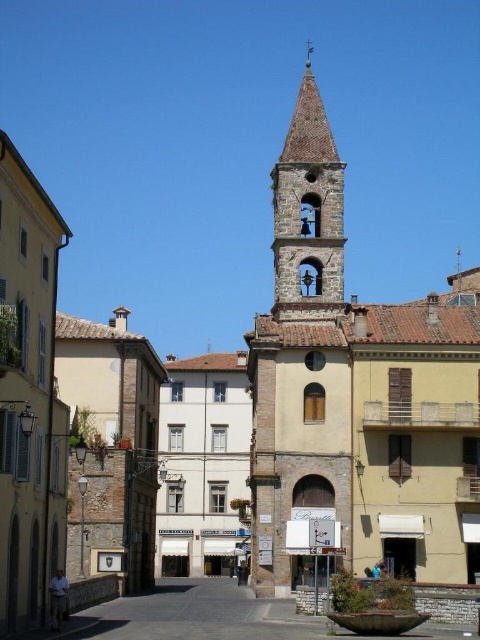
Does light brown stone church at center appear on the right side of stone bell tower at center?

Correct, you'll find light brown stone church at center to the right of stone bell tower at center.

Does light brown stone church at center appear on the left side of stone bell tower at center?

In fact, light brown stone church at center is to the right of stone bell tower at center.

Who is more distant from viewer, (334,554) or (315,241)?

Positioned behind is point (315,241).

At what (x,y) coordinates should I click in order to perform the action: click on light brown stone church at center. Please return your answer as a coordinate pair (x, y). Looking at the image, I should click on (356, 397).

Who is more forward, (208, 593) or (279, 198)?

Point (208, 593) is more forward.

The image size is (480, 640). In order to click on smooth concrete alley at center in this screenshot , I will do `click(193, 616)`.

Can you confirm if light brown stone church at center is taller than smooth concrete alley at center?

Correct, light brown stone church at center is much taller as smooth concrete alley at center.

Is point (284, 566) behind point (136, 625)?

Yes.

Which is behind, point (351, 472) or point (255, 621)?

Positioned behind is point (351, 472).

Locate an element on the screen. The height and width of the screenshot is (640, 480). light brown stone church at center is located at coordinates (356, 397).